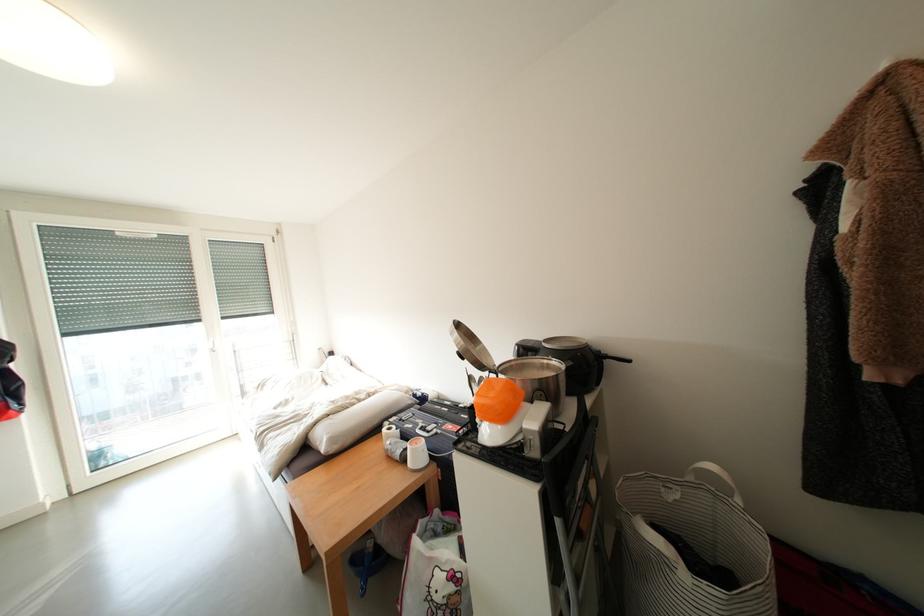
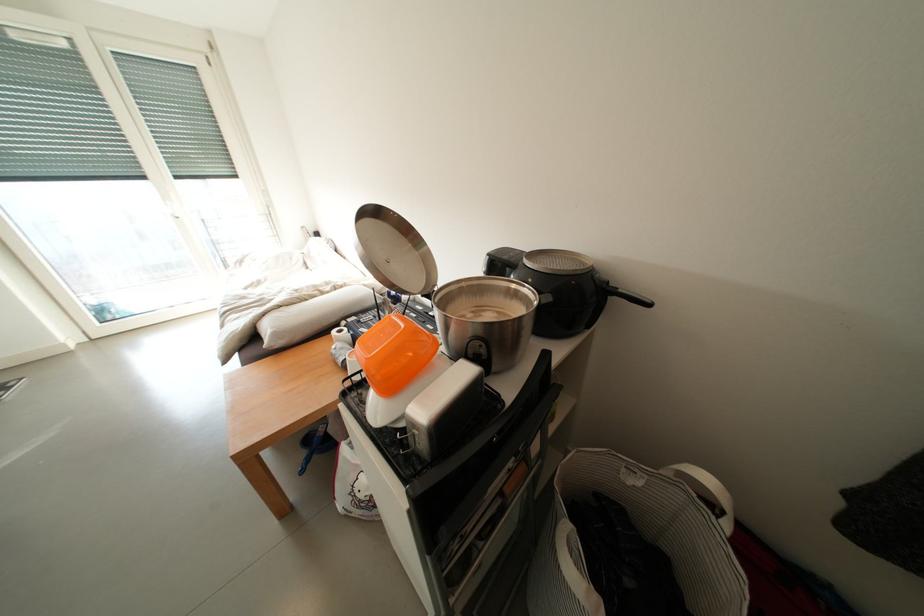
Based on the photo, what movement of the cameraman would produce the second image?

The cameraman moved toward right, forward.